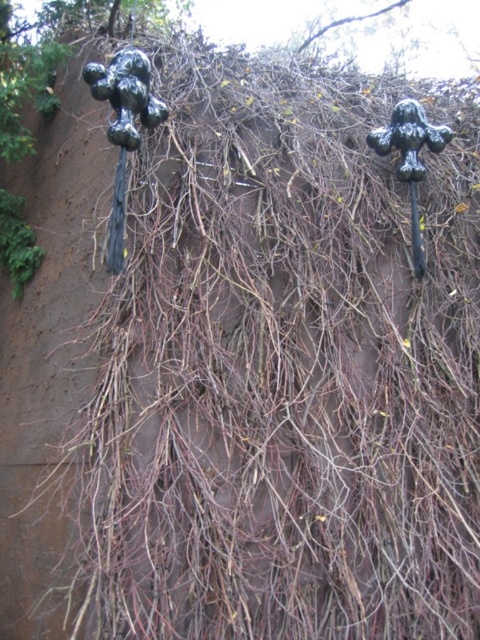
Question: Which point is closer to the camera?

Choices:
 (A) black matte sculpture at right
 (B) glossy black sculpture at upper left

Answer: (B)

Question: Does glossy black sculpture at upper left have a lesser width compared to black matte sculpture at right?

Choices:
 (A) yes
 (B) no

Answer: (A)

Question: Can you confirm if glossy black sculpture at upper left is positioned below black matte sculpture at right?

Choices:
 (A) no
 (B) yes

Answer: (A)

Question: Does glossy black sculpture at upper left have a larger size compared to black matte sculpture at right?

Choices:
 (A) yes
 (B) no

Answer: (B)